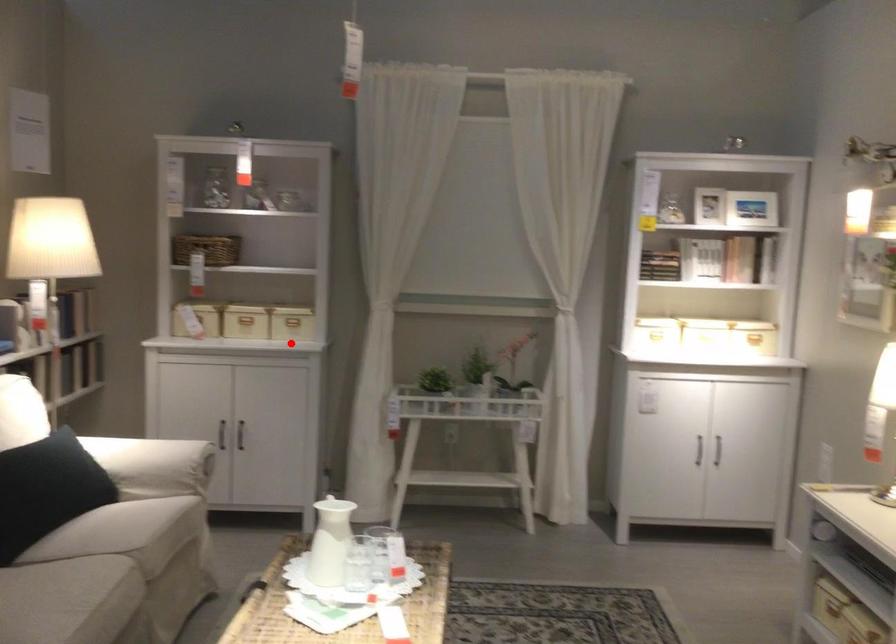
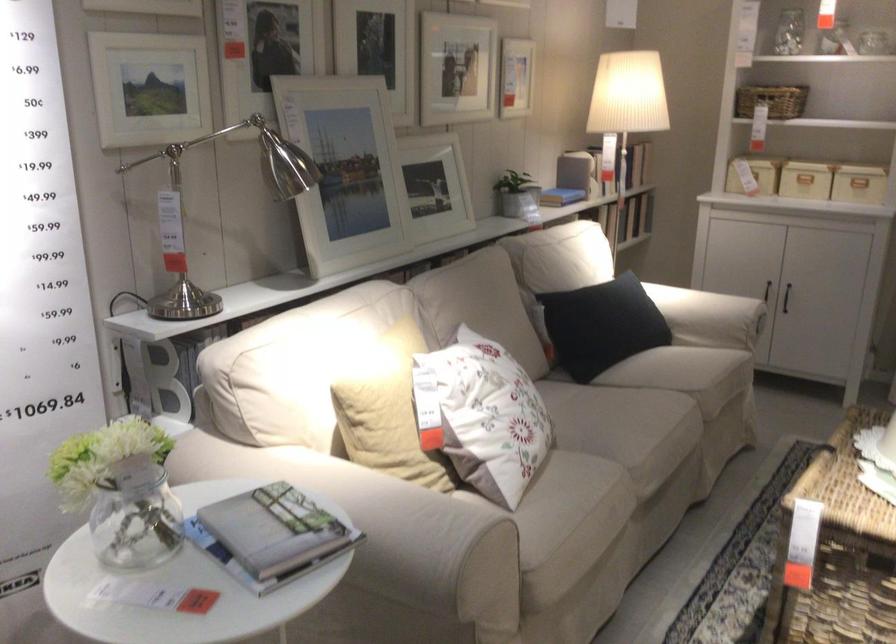
In the second image, find the point that corresponds to the highlighted location in the first image.

(858, 184)